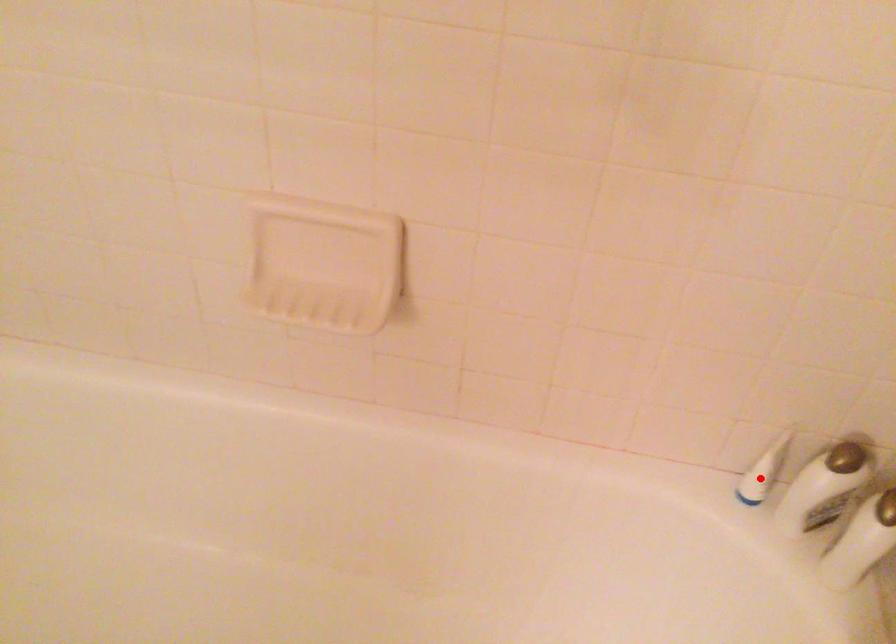
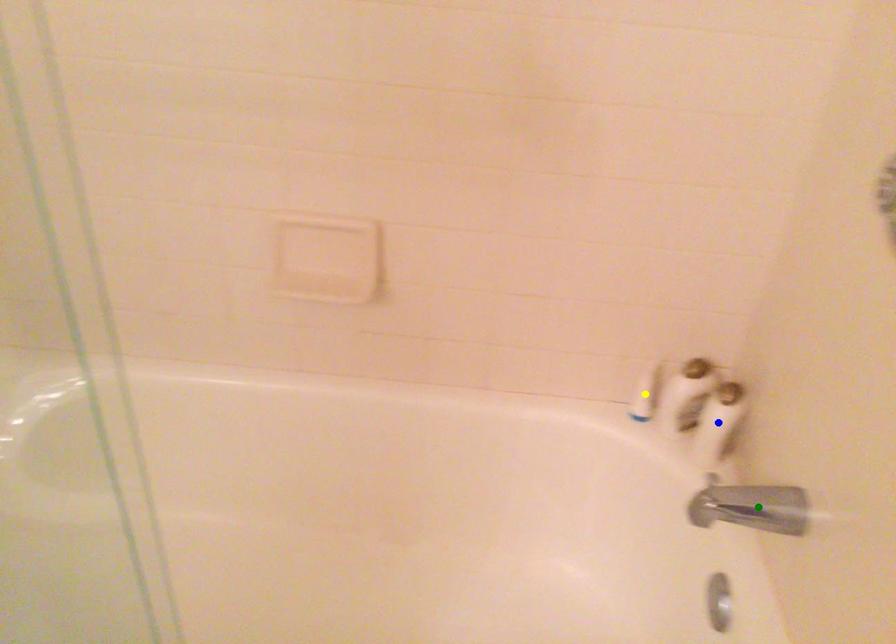
Question: I am providing you with two images of the same scene from different viewpoints. A red point is marked on the first image. You are given multiple points on the second image. Which spot in image 2 lines up with the point in image 1?

Choices:
 (A) yellow point
 (B) blue point
 (C) green point

Answer: (A)